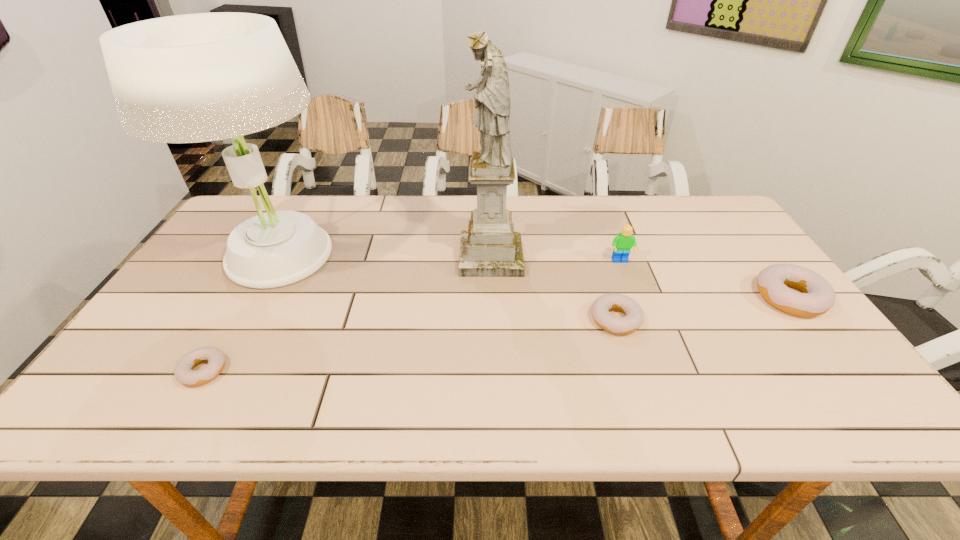
In order to click on location for an additional doughnut to make spacing equal in this screenshot , I will do `click(421, 343)`.